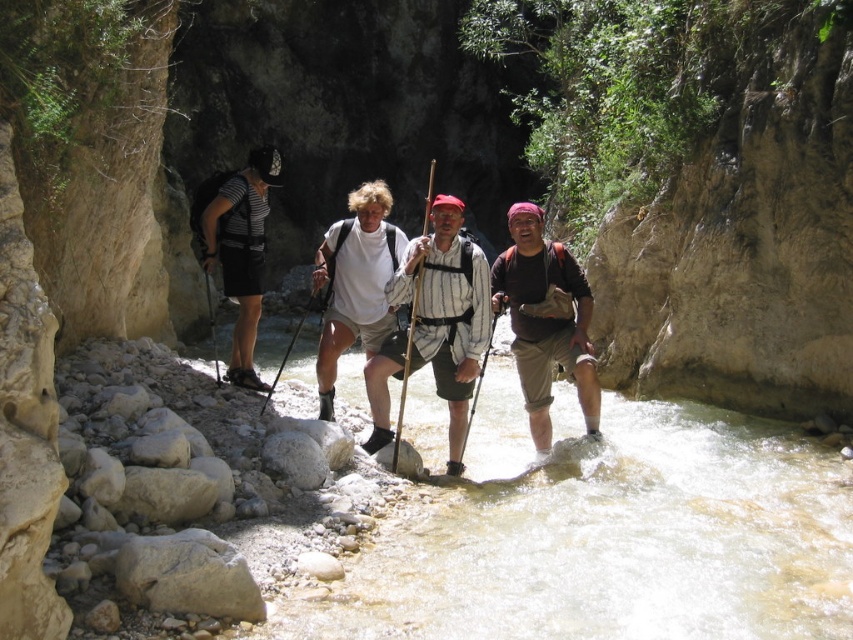
Is white cotton shirt at center shorter than striped cotton shirt at center?

In fact, white cotton shirt at center may be taller than striped cotton shirt at center.

Which is behind, point (447, 394) or point (432, 259)?

The point (447, 394) is behind.

I want to click on white cotton shirt at center, so click(422, 337).

Which is above, white cotton shirt at center or striped fabric backpack at left?

Positioned higher is white cotton shirt at center.

Is the position of white cotton shirt at center less distant than that of striped fabric backpack at left?

Yes, it is.

Where is `white cotton shirt at center`? This screenshot has width=853, height=640. white cotton shirt at center is located at coordinates (422, 337).

Between striped cotton shirt at center and striped fabric backpack at left, which one appears on the left side from the viewer's perspective?

Positioned to the left is striped fabric backpack at left.

This screenshot has width=853, height=640. What do you see at coordinates (447, 310) in the screenshot?
I see `striped cotton shirt at center` at bounding box center [447, 310].

At what (x,y) coordinates should I click in order to perform the action: click on striped cotton shirt at center. Please return your answer as a coordinate pair (x, y). This screenshot has width=853, height=640. Looking at the image, I should click on (447, 310).